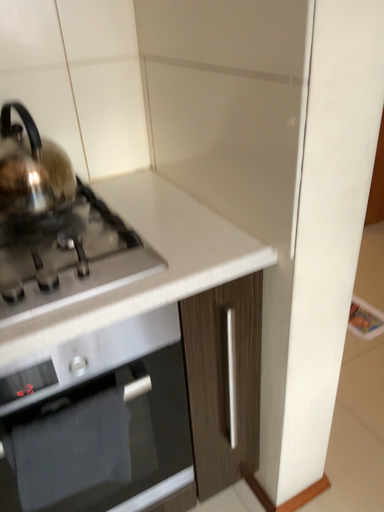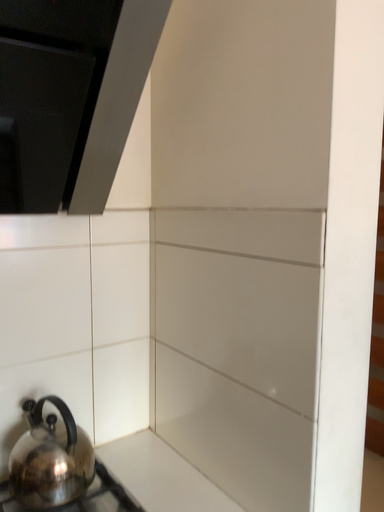
Question: Which way did the camera rotate in the video?

Choices:
 (A) rotated left
 (B) rotated right

Answer: (B)